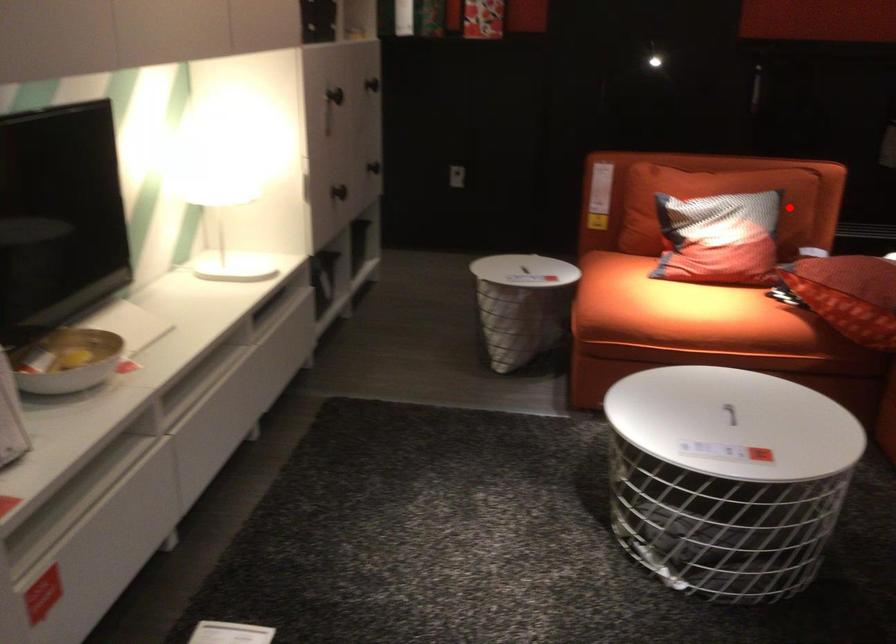
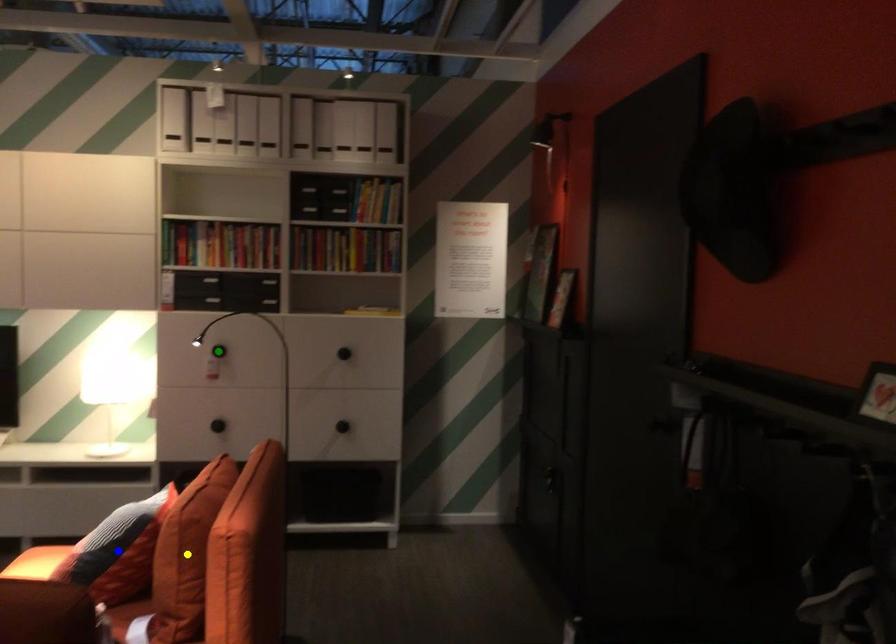
Question: I am providing you with two images of the same scene from different viewpoints. A red point is marked on the first image. You are given multiple points on the second image. Which mark in image 2 goes with the point in image 1?

Choices:
 (A) green point
 (B) blue point
 (C) yellow point

Answer: (B)